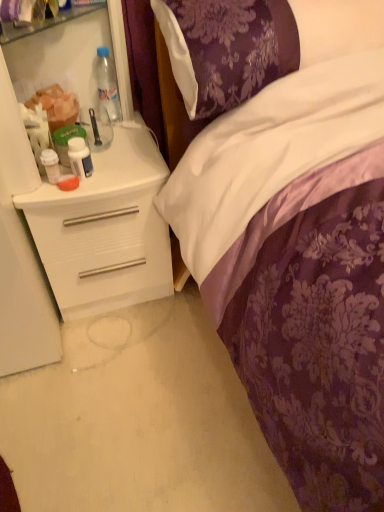
Where is `spots to the right of white glossy pill bottle at left, which is the 2th bottle from top to bottom`? This screenshot has height=512, width=384. spots to the right of white glossy pill bottle at left, which is the 2th bottle from top to bottom is located at coordinates (127, 172).